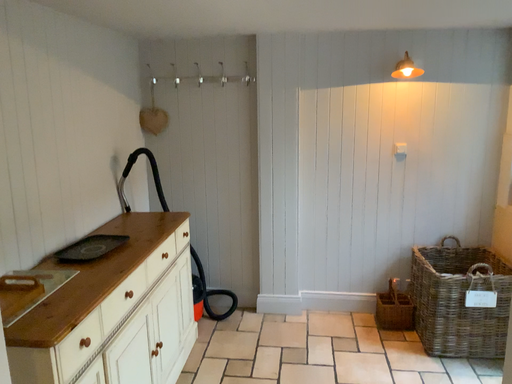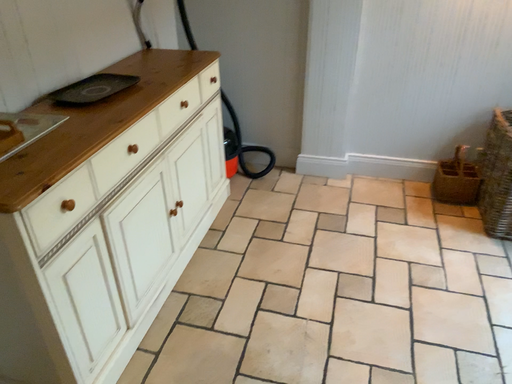
Question: How did the camera likely rotate when shooting the video?

Choices:
 (A) rotated downward
 (B) rotated upward

Answer: (A)